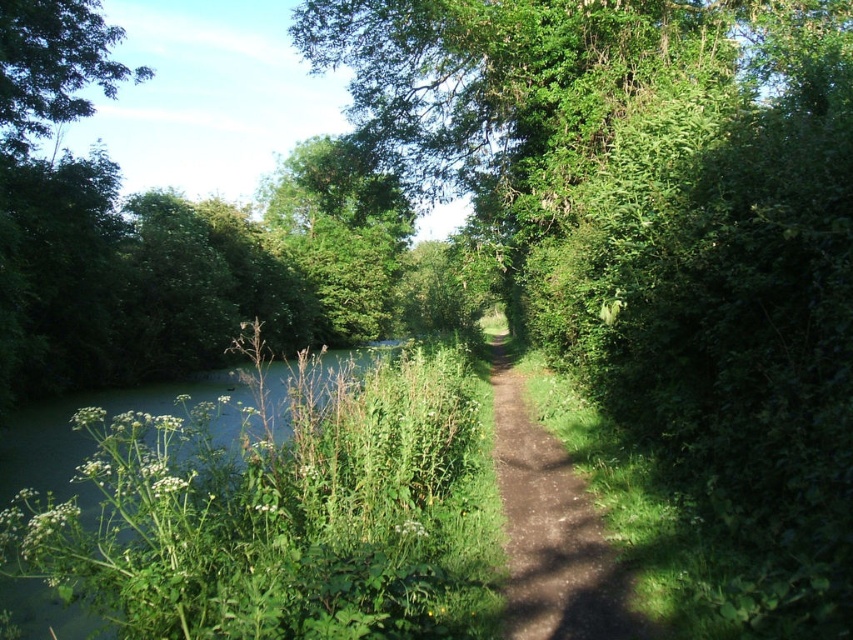
Question: Does green leafy tree at center appear under green leafy tree at upper left?

Choices:
 (A) no
 (B) yes

Answer: (B)

Question: Which is nearer to the green leafy tree at center?

Choices:
 (A) brown dirt path at center
 (B) green leafy tree at upper left

Answer: (A)

Question: Does green leafy tree at center lie in front of brown dirt path at center?

Choices:
 (A) yes
 (B) no

Answer: (A)

Question: Does green leafy tree at center have a smaller size compared to green leafy tree at upper left?

Choices:
 (A) yes
 (B) no

Answer: (B)

Question: Among these objects, which one is nearest to the camera?

Choices:
 (A) green leafy tree at center
 (B) green leafy tree at upper left
 (C) brown dirt path at center

Answer: (A)

Question: Which object appears farthest from the camera in this image?

Choices:
 (A) green leafy tree at center
 (B) brown dirt path at center

Answer: (B)